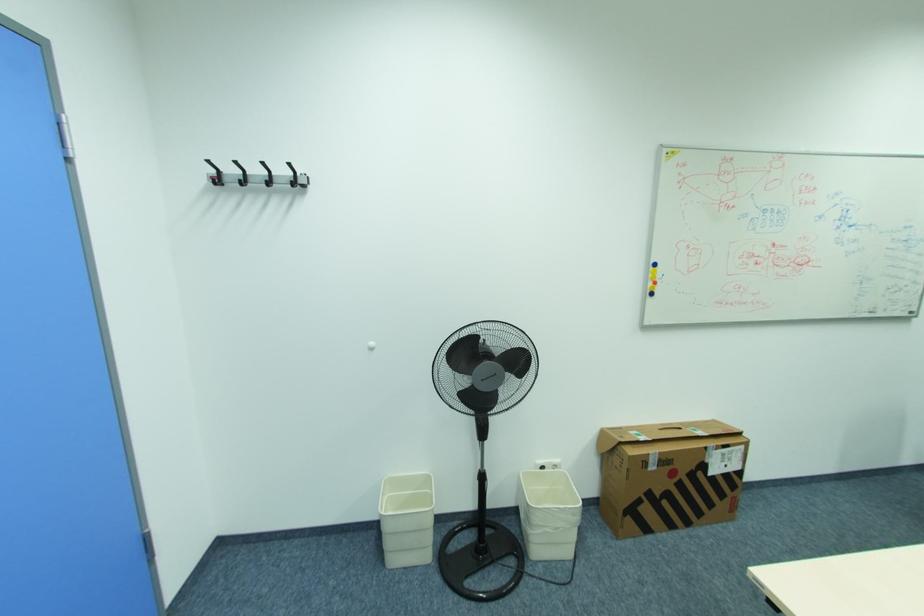
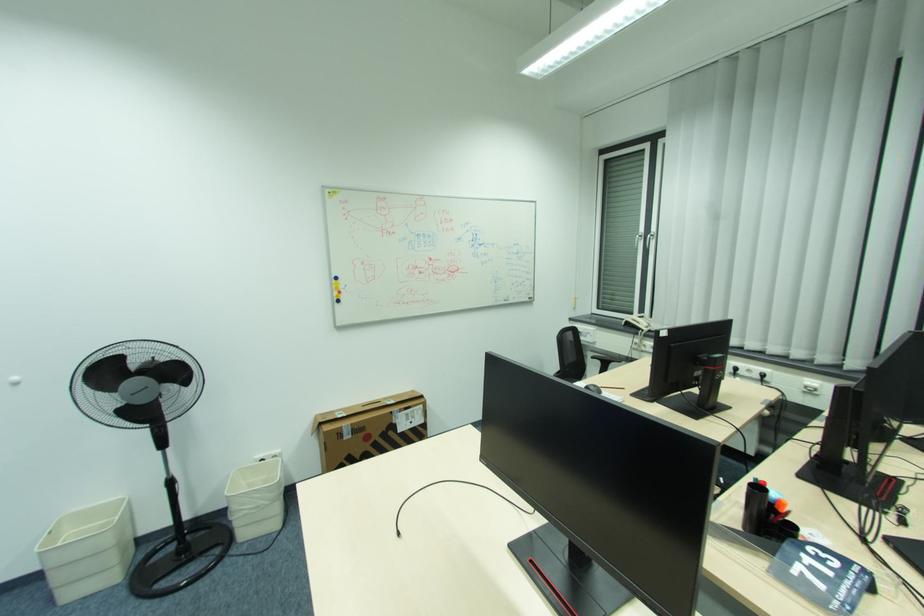
Where in the second image is the point corresponding to point 655,284 from the first image?

(341, 294)